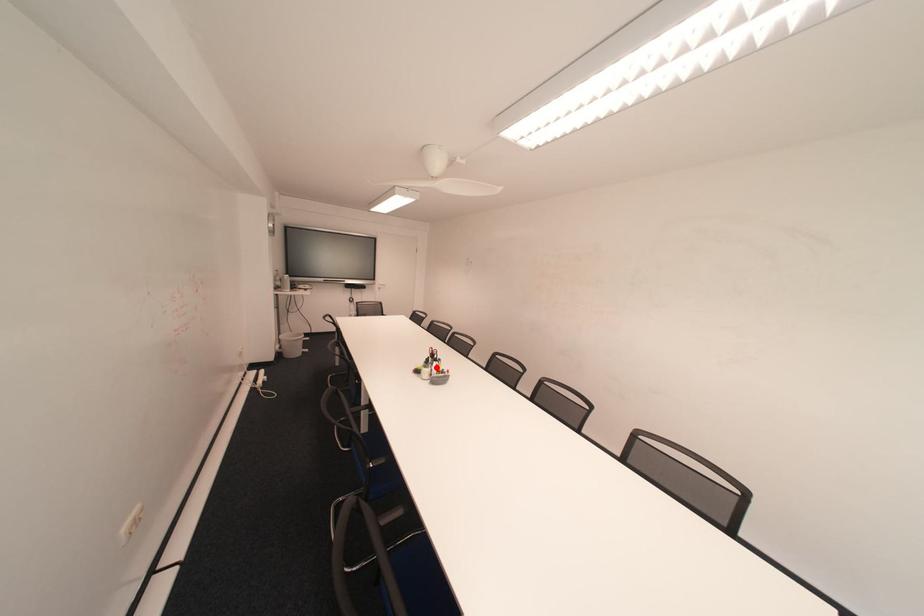
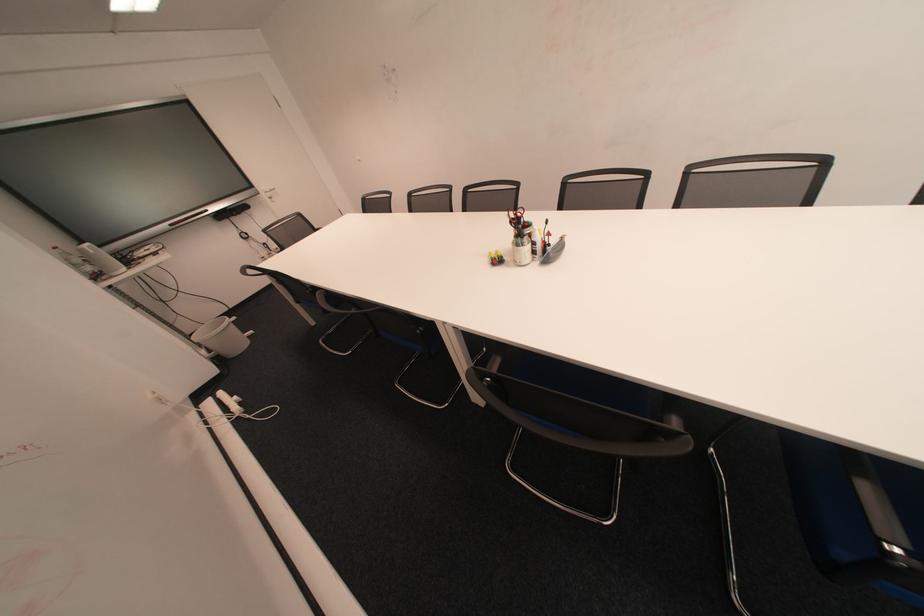
Question: I am providing you with two images of the same scene from different viewpoints. A red point is shown in image1. For the corresponding object point in image2, is it positioned nearer or farther from the camera?

Choices:
 (A) Nearer
 (B) Farther

Answer: (A)